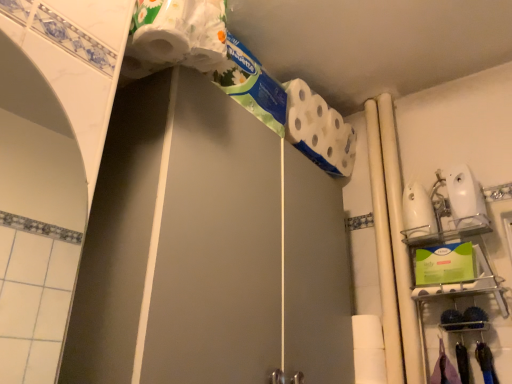
Question: Can you confirm if white glossy screen door at upper center is thinner than white matte toilet paper at upper center?

Choices:
 (A) no
 (B) yes

Answer: (A)

Question: Are white glossy screen door at upper center and white matte toilet paper at upper center making contact?

Choices:
 (A) yes
 (B) no

Answer: (B)

Question: Can you confirm if white glossy screen door at upper center is taller than white matte toilet paper at upper center?

Choices:
 (A) no
 (B) yes

Answer: (B)

Question: From a real-world perspective, is white glossy screen door at upper center under white matte toilet paper at upper center?

Choices:
 (A) yes
 (B) no

Answer: (A)

Question: Does white glossy screen door at upper center contain white matte toilet paper at upper center?

Choices:
 (A) no
 (B) yes

Answer: (A)

Question: Does white glossy screen door at upper center have a lesser height compared to white matte toilet paper at upper center?

Choices:
 (A) no
 (B) yes

Answer: (A)

Question: Does white glossy beam at right, acting as the second beam starting from the left, have a smaller size compared to white glossy screen door at upper center?

Choices:
 (A) no
 (B) yes

Answer: (B)

Question: Would you say white glossy screen door at upper center is part of white glossy beam at right, acting as the second beam starting from the left,'s contents?

Choices:
 (A) yes
 (B) no

Answer: (B)

Question: From the image's perspective, is white glossy beam at right, acting as the second beam starting from the left, over white glossy screen door at upper center?

Choices:
 (A) yes
 (B) no

Answer: (A)

Question: Is white glossy beam at right, acting as the second beam starting from the left, looking in the opposite direction of white glossy screen door at upper center?

Choices:
 (A) yes
 (B) no

Answer: (B)

Question: Does white glossy beam at right, acting as the second beam starting from the left, come behind white glossy screen door at upper center?

Choices:
 (A) yes
 (B) no

Answer: (A)

Question: Is white glossy beam at right, which ranks as the first beam in right-to-left order, aimed at white glossy screen door at upper center?

Choices:
 (A) no
 (B) yes

Answer: (A)

Question: Does white matte pipe at center right, positioned as the 2th beam in right-to-left order, touch white glossy beam at right, which ranks as the first beam in right-to-left order?

Choices:
 (A) yes
 (B) no

Answer: (A)